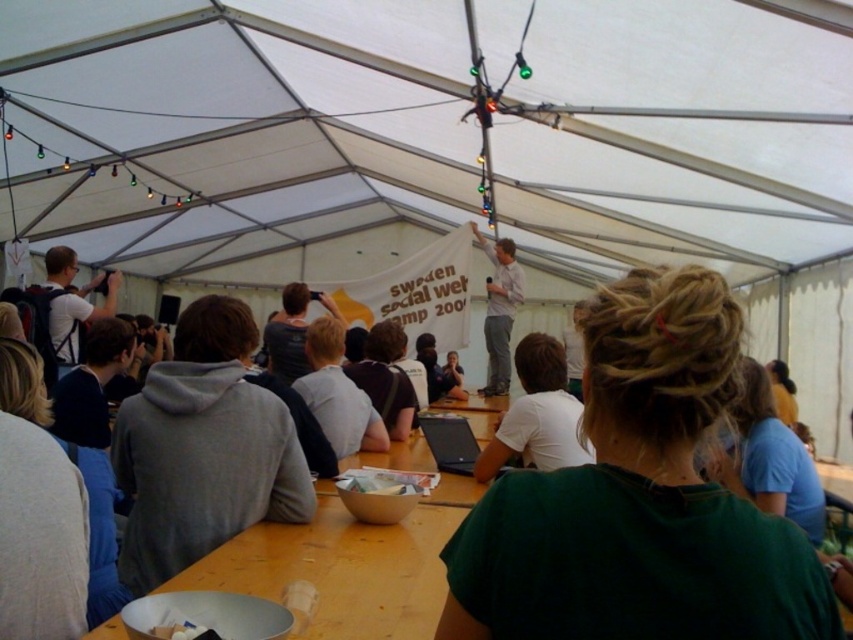
Who is higher up, gray hoodie at center or light gray shirt at upper center?

light gray shirt at upper center is higher up.

Measure the distance between gray hoodie at center and light gray shirt at upper center.

17.23 feet

You are a GUI agent. You are given a task and a screenshot of the screen. Output one action in this format:
    pyautogui.click(x=<x>, y=<y>)
    Task: Click on the gray hoodie at center
    Image resolution: width=853 pixels, height=640 pixels.
    Given the screenshot: What is the action you would take?
    pyautogui.click(x=202, y=449)

Which is more to the left, gray hoodie at center or blue cotton shirt at upper right?

Positioned to the left is gray hoodie at center.

Does gray hoodie at center have a smaller size compared to blue cotton shirt at upper right?

No.

Is point (154, 538) closer to viewer compared to point (749, 385)?

Yes.

This screenshot has height=640, width=853. In order to click on gray hoodie at center in this screenshot , I will do `click(202, 449)`.

Can you confirm if white matte laptop at center is smaller than blue cotton shirt at upper right?

Actually, white matte laptop at center might be larger than blue cotton shirt at upper right.

Locate an element on the screen. The height and width of the screenshot is (640, 853). white matte laptop at center is located at coordinates (537, 413).

Image resolution: width=853 pixels, height=640 pixels. Identify the location of white matte laptop at center. (537, 413).